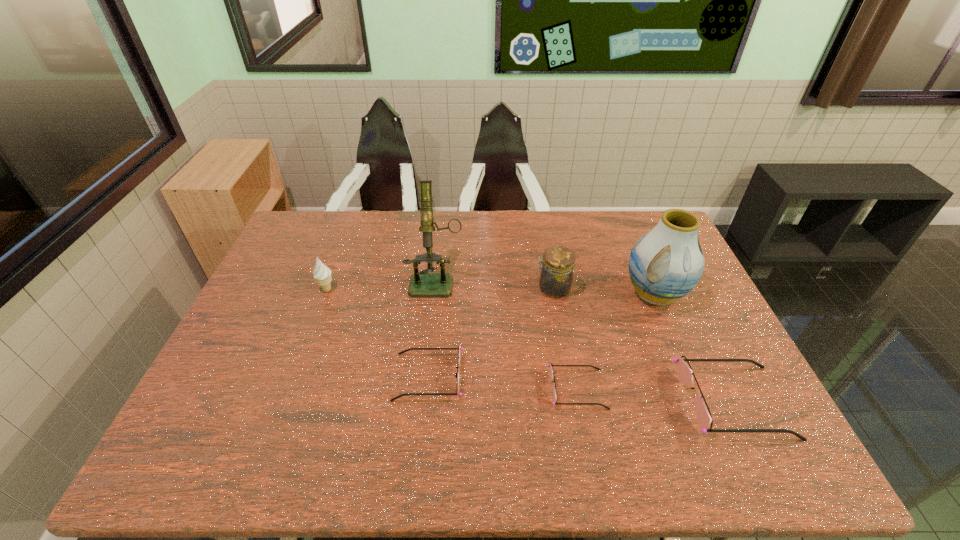
I want to click on vacant area in the image that satisfies the following two spatial constraints: 1. at the eyepiece of the vase; 2. on the left side of the microscope, so [x=435, y=294].

This screenshot has height=540, width=960. What are the coordinates of `vacant region that satisfies the following two spatial constraints: 1. on the front-facing side of the vase; 2. on the left side of the leftmost object` in the screenshot? It's located at (325, 294).